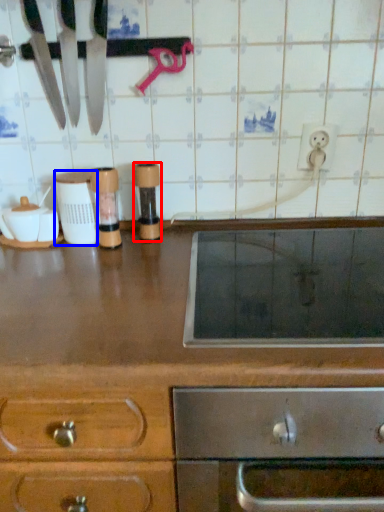
Question: Which object is closer to the camera taking this photo, appliance (highlighted by a red box) or appliance (highlighted by a blue box)?

Choices:
 (A) appliance
 (B) appliance

Answer: (B)